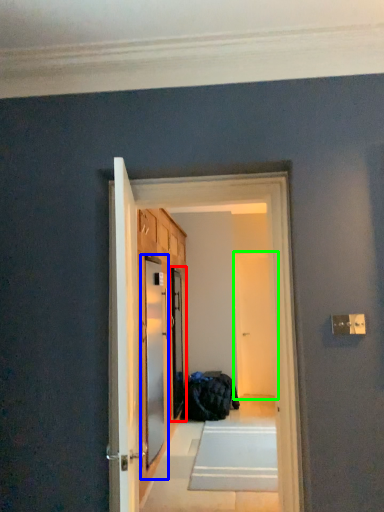
Question: Which object is the farthest from screen door (highlighted by a red box)? Choose among these: screen door (highlighted by a blue box) or screen door (highlighted by a green box).

Choices:
 (A) screen door
 (B) screen door

Answer: (B)